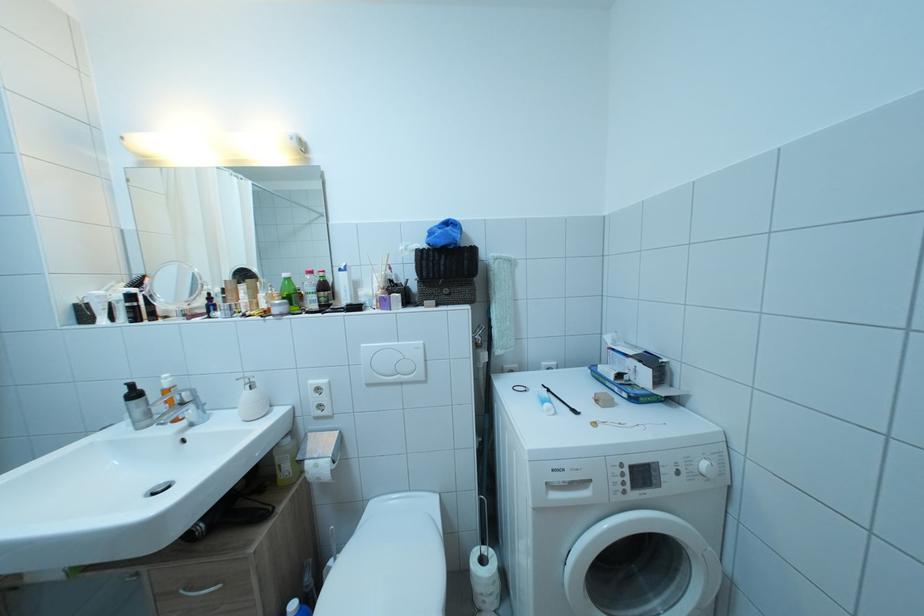
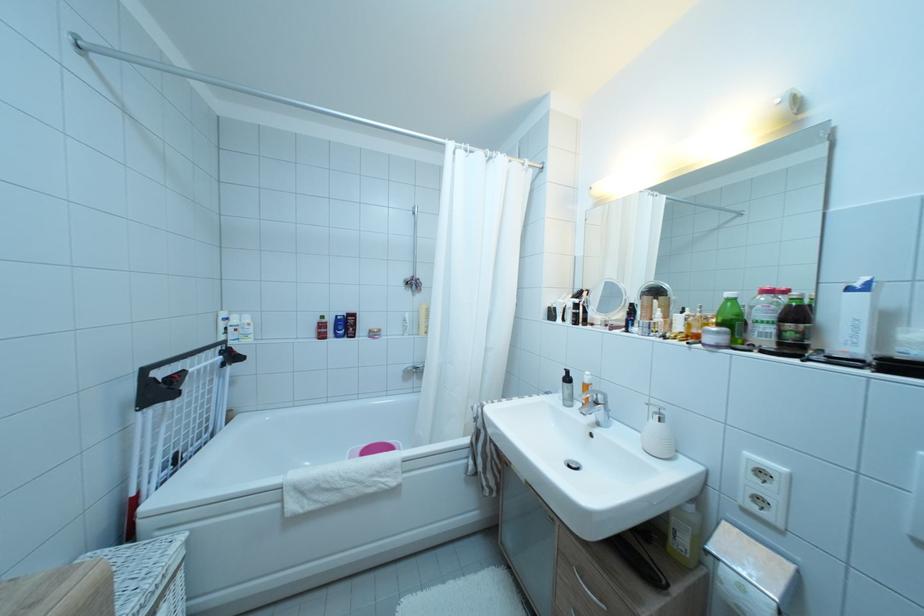
Find the pixel in the second image that matches (x=293, y=281) in the first image.

(736, 300)